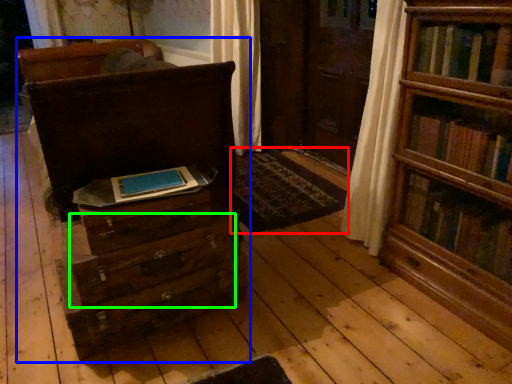
Question: Based on their relative distances, which object is farther from mat (highlighted by a red box)? Choose from chest of drawers (highlighted by a blue box) and drawer (highlighted by a green box).

Choices:
 (A) chest of drawers
 (B) drawer

Answer: (B)